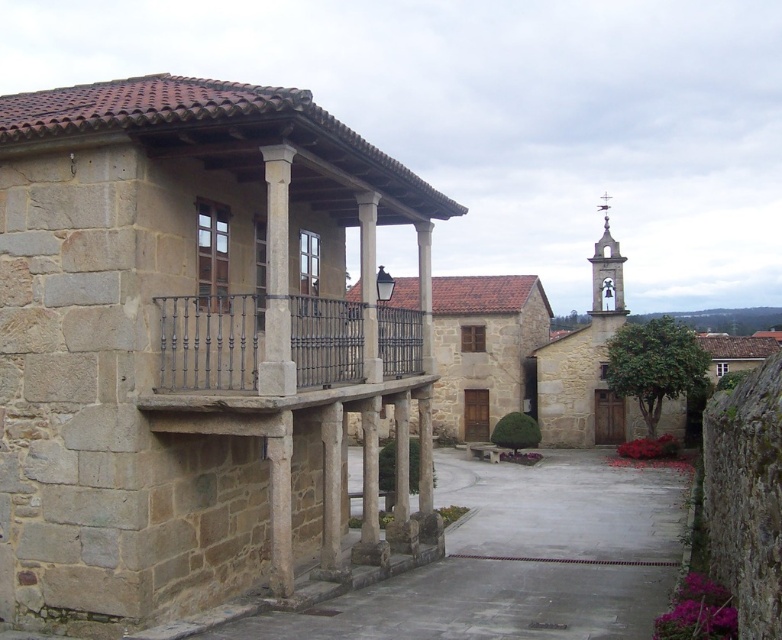
You are an architect designing a new courtyard and want to ensure structural integrity. Given the black wrought iron balcony at center and the smooth stone bell tower at upper right, which structure would you prioritize reinforcing if one of them is more prone to bending or breaking under heavy snow? Explain your reasoning based on their descriptions.

The black wrought iron balcony at center is thinner than the smooth stone bell tower at upper right, so the balcony would be more prone to bending or breaking under heavy snow. Therefore, it should be prioritized for reinforcement.

You are an architect designing a scale model of this courtyard. You need to ensure the black wrought iron balcony at center and the smooth stone bell tower at upper right are proportionally accurate. Which object should be made smaller in the model?

The black wrought iron balcony at center should be made smaller in the model because it has a smaller size compared to the smooth stone bell tower at upper right.